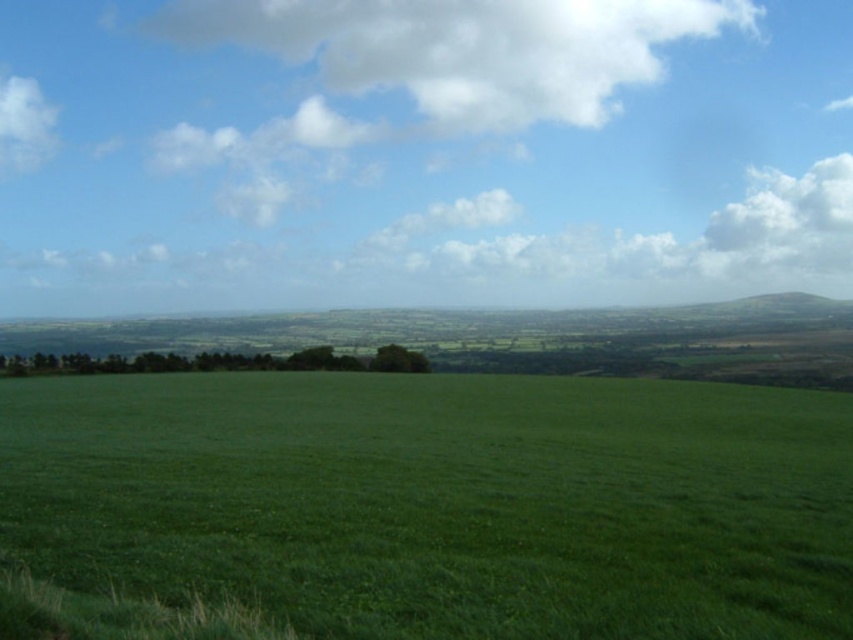
Is point (126, 397) less distant than point (473, 68)?

Yes, it is in front of point (473, 68).

Between green grassy field at center and white fluffy cloud at upper center, which one is positioned lower?

green grassy field at center

What do you see at coordinates (442, 500) in the screenshot?
I see `green grassy field at center` at bounding box center [442, 500].

Locate an element on the screen. The image size is (853, 640). green grassy field at center is located at coordinates (442, 500).

Is green grassy field at center further to camera compared to white fluffy cloud at upper left?

No, green grassy field at center is in front of white fluffy cloud at upper left.

Can you confirm if green grassy field at center is shorter than white fluffy cloud at upper left?

Yes.

Between point (675, 528) and point (15, 141), which one is positioned behind?

Positioned behind is point (15, 141).

You are a GUI agent. You are given a task and a screenshot of the screen. Output one action in this format:
    pyautogui.click(x=<x>, y=<y>)
    Task: Click on the green grassy field at center
    This screenshot has width=853, height=640.
    Given the screenshot: What is the action you would take?
    pyautogui.click(x=442, y=500)

Can you confirm if cloudy sky at upper center is wider than white fluffy cloud at upper center?

Yes, cloudy sky at upper center is wider than white fluffy cloud at upper center.

Which is below, cloudy sky at upper center or white fluffy cloud at upper center?

cloudy sky at upper center

I want to click on cloudy sky at upper center, so click(428, 152).

The image size is (853, 640). What are the coordinates of `cloudy sky at upper center` in the screenshot? It's located at (428, 152).